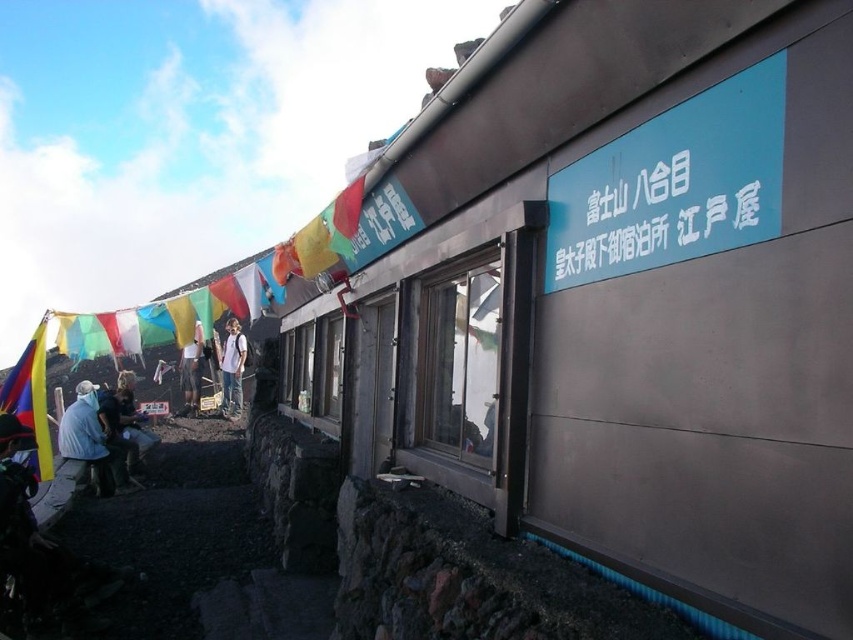
Is the position of white cotton shirt at center more distant than that of white plastic sign at upper center?

Yes, it is behind white plastic sign at upper center.

Is point (241, 385) positioned behind point (149, 403)?

Yes, point (241, 385) is farther from viewer.

Locate an element on the screen. Image resolution: width=853 pixels, height=640 pixels. white cotton shirt at center is located at coordinates (231, 369).

Is point (195, 394) positioned in front of point (155, 416)?

No.

Does light blue fabric at center have a larger size compared to white plastic sign at upper center?

Indeed, light blue fabric at center has a larger size compared to white plastic sign at upper center.

Image resolution: width=853 pixels, height=640 pixels. In order to click on light blue fabric at center in this screenshot , I will do tap(190, 371).

Is multicolored fabric flag at left positioned behind denim jacket at lower left?

That is False.

Can you confirm if multicolored fabric flag at left is thinner than denim jacket at lower left?

In fact, multicolored fabric flag at left might be wider than denim jacket at lower left.

The width and height of the screenshot is (853, 640). Describe the element at coordinates (32, 401) in the screenshot. I see `multicolored fabric flag at left` at that location.

Identify the location of multicolored fabric flag at left. The image size is (853, 640). [x=32, y=401].